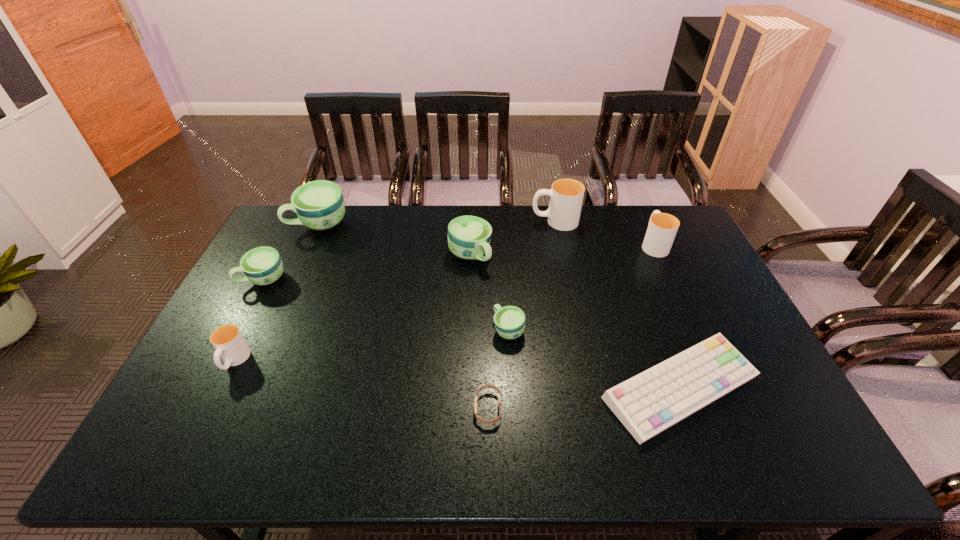
Image resolution: width=960 pixels, height=540 pixels. In order to click on blank region between the smallest blue cup and the second farthest yellow cup in this screenshot , I will do `click(581, 287)`.

Select which object is the fourth closest to the rightmost yellow cup. Please provide its 2D coordinates. Your answer should be formatted as a tuple, i.e. [(x, y)], where the tuple contains the x and y coordinates of a point satisfying the conditions above.

[(469, 237)]

Image resolution: width=960 pixels, height=540 pixels. Identify the location of the third closest object to the third biggest blue cup. (469, 237).

Locate an element on the screen. cup object that ranks as the sixth closest to the second biggest yellow cup is located at coordinates (228, 341).

The image size is (960, 540). What are the coordinates of `cup that is the fourth closest to the seventh tallest object` in the screenshot? It's located at (319, 205).

Locate an element on the screen. This screenshot has width=960, height=540. the second closest yellow cup to the computer keyboard is located at coordinates (566, 195).

Choose which yellow cup is the third nearest neighbor to the farthest blue cup. Please provide its 2D coordinates. Your answer should be formatted as a tuple, i.e. [(x, y)], where the tuple contains the x and y coordinates of a point satisfying the conditions above.

[(662, 228)]

What are the coordinates of `blue cup that is the second closest to the nearest blue cup` in the screenshot? It's located at (319, 205).

Locate which blue cup is the third closest to the farthest blue cup. Please provide its 2D coordinates. Your answer should be formatted as a tuple, i.e. [(x, y)], where the tuple contains the x and y coordinates of a point satisfying the conditions above.

[(509, 321)]

This screenshot has width=960, height=540. I want to click on vacant space that satisfies the following two spatial constraints: 1. on the back side of the third shortest object; 2. with the handle on the side of the biggest yellow cup, so click(x=502, y=221).